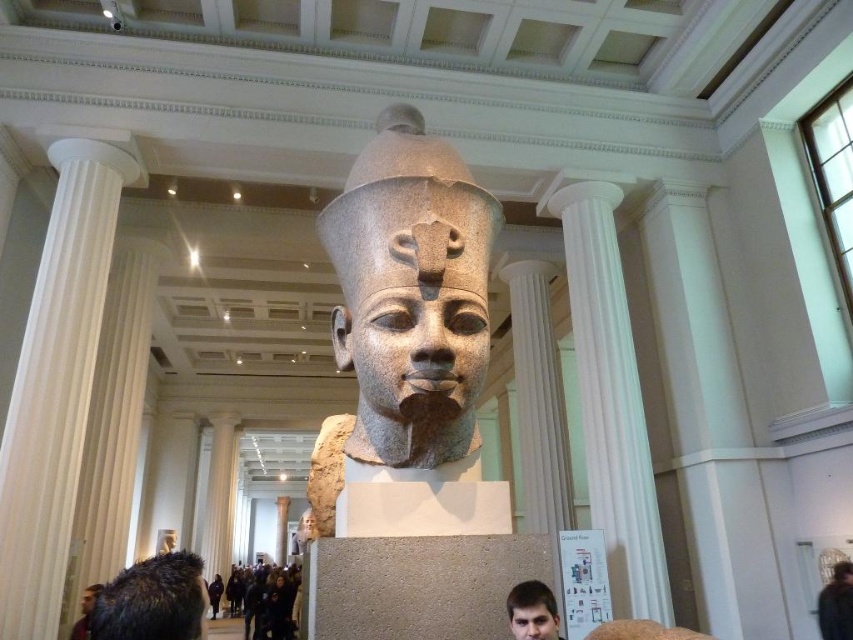
You are an interior designer planning to hang a large painting that requires a 1.8 meters height clearance. Based on the scene, can the gray stone head at center and the white marble column at left provide enough vertical space for the painting?

The gray stone head at center has a lesser height compared to white marble column at left. Since the column is taller, the vertical space between them might be sufficient for the painting, but the exact height of the column isn

You are an art curator planning to move the gray stone head at center and the white marble column at left to a smaller exhibition space. Which object will require more space to accommodate in the new location?

The white marble column at left requires more space because it occupies more space than the gray stone head at center.

You are standing in the museum and want to take a photo of the white marble column at center. If you are positioned at the entrance, which is at the bottom of the image, where should you aim your camera to capture the column in the frame?

You should aim your camera towards the center area of the image, specifically targeting the coordinates approximately at point 0.625 on the x axis and 0.716 on the y axis, which corresponds to the location of the white marble column at center.